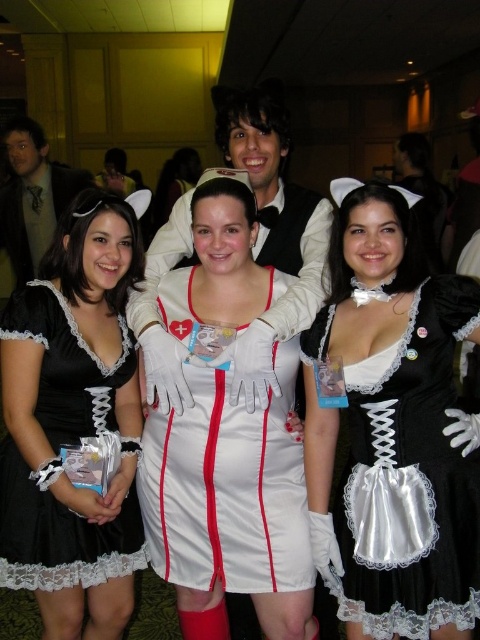
Question: Which object is farther from the camera taking this photo?

Choices:
 (A) black satin dress at center
 (B) white satin dress at center

Answer: (B)

Question: Does satin black dress at center come in front of matte black vest at center?

Choices:
 (A) no
 (B) yes

Answer: (B)

Question: Which of these objects is positioned closest to the white satin dress at center?

Choices:
 (A) matte black vest at center
 (B) satin black dress at center

Answer: (B)

Question: Which object is the farthest from the satin black dress at center?

Choices:
 (A) white satin dress at center
 (B) matte black suit at upper left
 (C) matte black vest at center

Answer: (B)

Question: Can you confirm if satin black dress at center is positioned to the left of matte black suit at upper left?

Choices:
 (A) yes
 (B) no

Answer: (B)

Question: From the image, what is the correct spatial relationship of black satin dress at center in relation to matte black vest at center?

Choices:
 (A) above
 (B) below

Answer: (B)